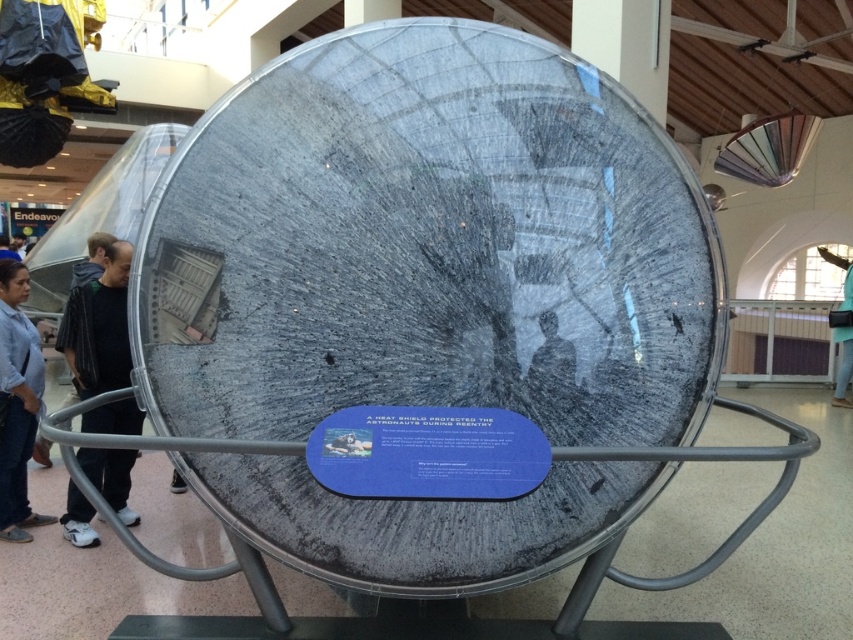
You are a security guard in the exhibition hall. You need to check the jacket and jeans left behind by a visitor. Where should you look first to find the dark gray fabric jacket at left and denim jeans at lower left?

The dark gray fabric jacket at left is to the right of the denim jeans at lower left, so you should check the area to the right of the denim jeans at lower left to find both items.

In the scene shown: You are an astronaut preparing for a mission and need to retrieve either the denim jeans at lower left or the matte black helmet at center. Which item is closer to you?

The denim jeans at lower left is closer to you because it is further to the viewer than the matte black helmet at center.